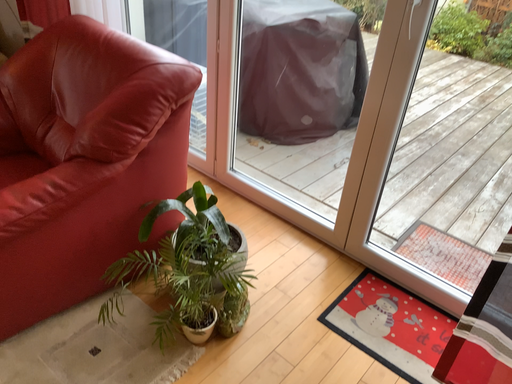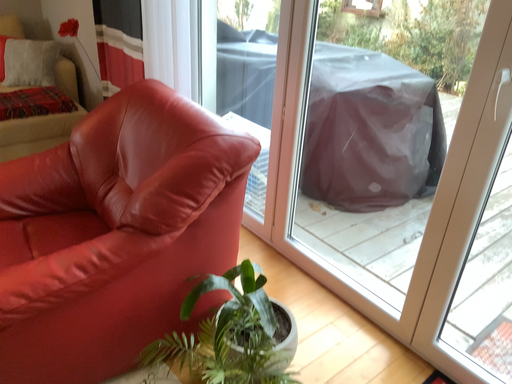
Question: Which way did the camera rotate in the video?

Choices:
 (A) rotated downward
 (B) rotated upward

Answer: (B)